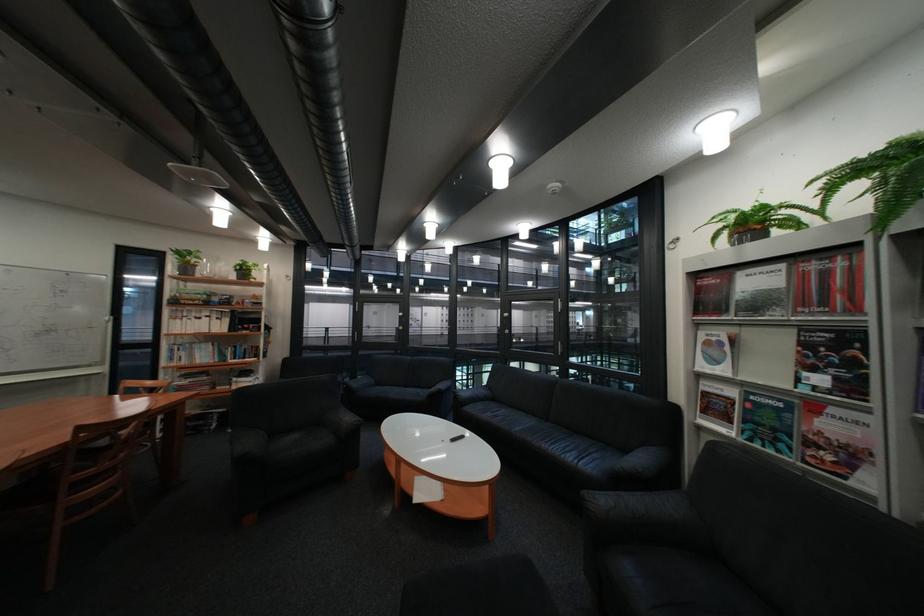
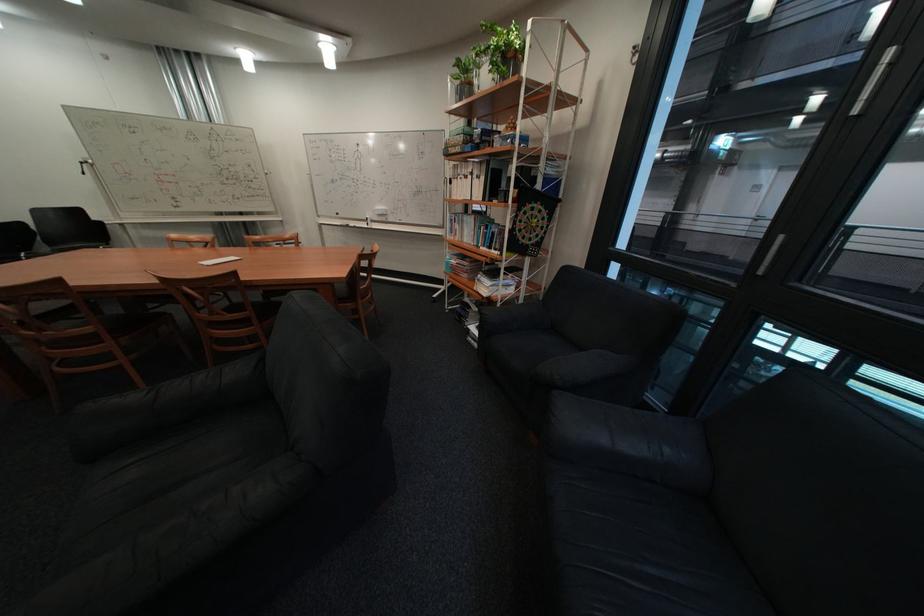
The point at (261,350) is marked in the first image. Where is the corresponding point in the second image?

(508, 233)